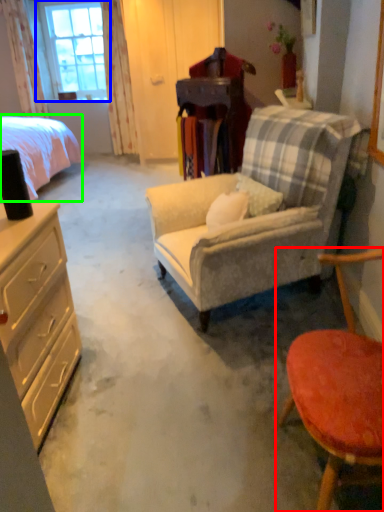
Question: Which object is positioned closest to chair (highlighted by a red box)? Select from window (highlighted by a blue box) and bed (highlighted by a green box).

Choices:
 (A) window
 (B) bed

Answer: (B)